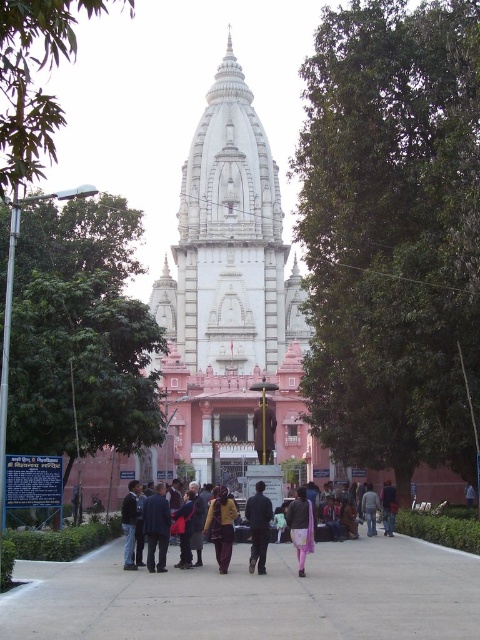
You are standing at the entrance of the temple and want to find the dark blue fabric jacket at center. According to the coordinates given, in which direction should you look to locate it?

The dark blue fabric jacket at center is located at coordinates point (156, 528), so you should look towards the lower right direction from the entrance to locate it.

You are a photographer planning to capture a wide shot of the scene. You want to ensure that both the white marble hindu temple at center and the dark blue jacket at center are fully visible in the frame. Considering their sizes, which object will require more horizontal space in the photograph?

The white marble hindu temple at center requires more horizontal space in the photograph because its width surpasses that of the dark blue jacket at center.